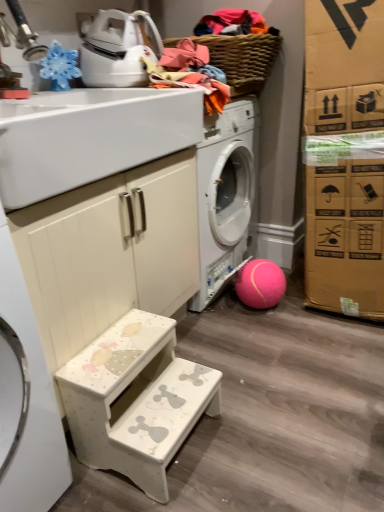
Question: Considering the positions of white glossy sink at upper left and white painted wood step stool at lower left in the image, is white glossy sink at upper left wider or thinner than white painted wood step stool at lower left?

Choices:
 (A) wide
 (B) thin

Answer: (A)

Question: In terms of size, does white glossy sink at upper left appear bigger or smaller than white painted wood step stool at lower left?

Choices:
 (A) big
 (B) small

Answer: (A)

Question: Considering the real-world distances, which object is closest to the white painted wood cabinet at lower left?

Choices:
 (A) white glossy sink at upper left
 (B) soft cotton clothes at upper center
 (C) pink rubber ball at lower right
 (D) white painted wood step stool at lower left
 (E) woven brown basket at upper center

Answer: (A)

Question: Based on their relative distances, which object is farther from the soft cotton clothes at upper center?

Choices:
 (A) woven brown basket at upper center
 (B) white glossy sink at upper left
 (C) pink rubber ball at lower right
 (D) white painted wood step stool at lower left
 (E) white painted wood cabinet at lower left

Answer: (D)